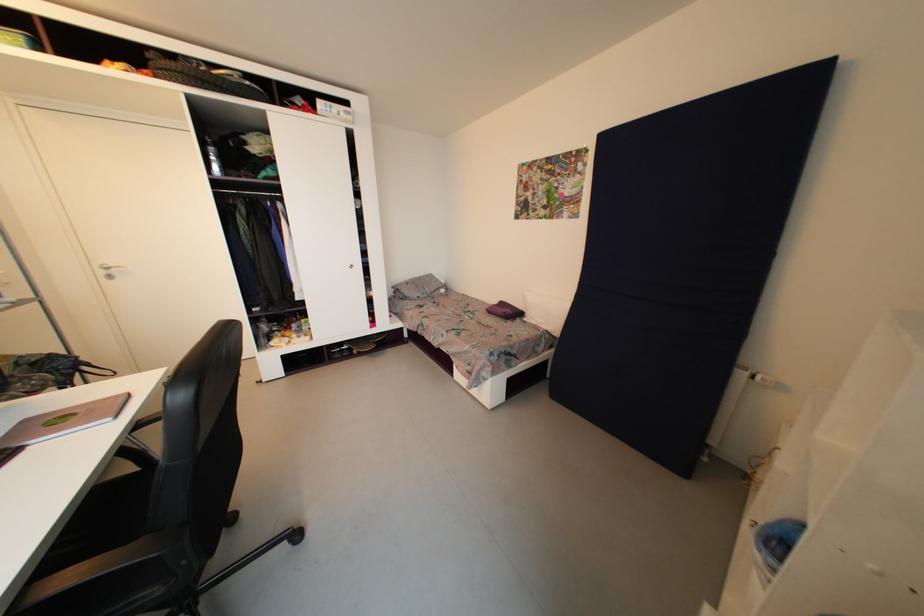
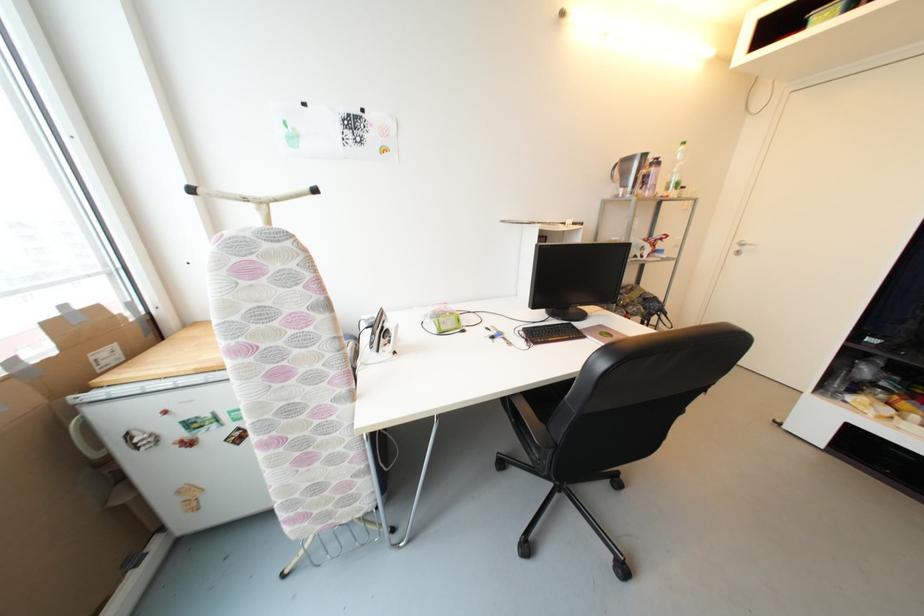
Where in the second image is the point corresponding to point 108,274 from the first image?

(742, 249)